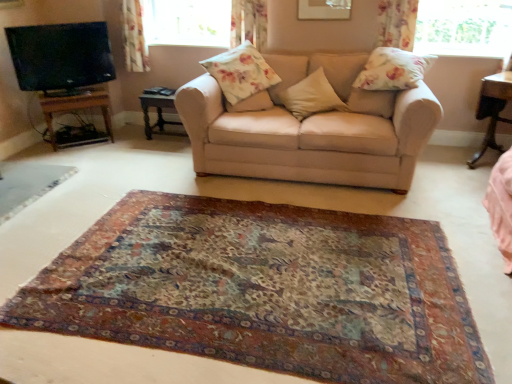
At what (x,y) coordinates should I click in order to perform the action: click on vacant space that is to the left of beige fabric couch at center. Please return your answer as a coordinate pair (x, y). The width and height of the screenshot is (512, 384). Looking at the image, I should click on (119, 173).